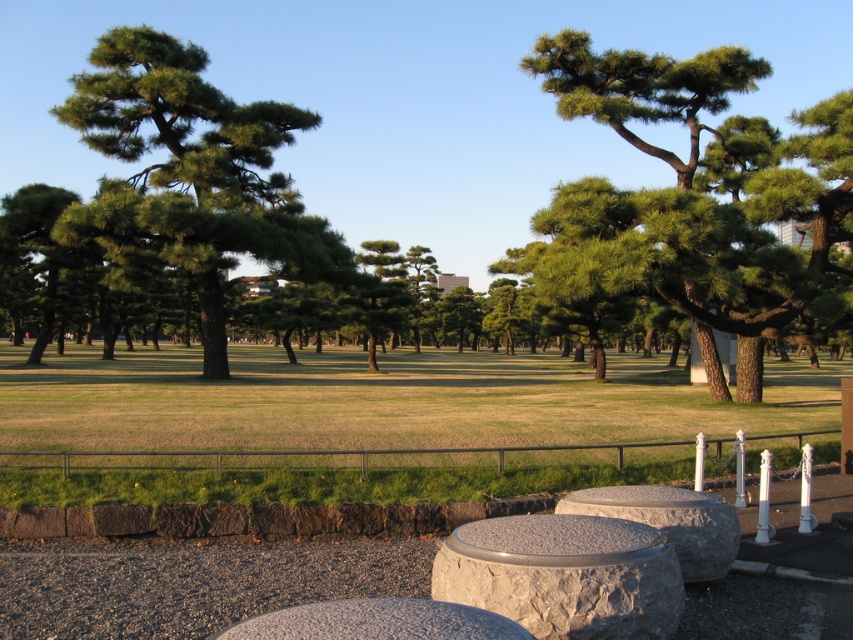
Question: Which of the following is the closest to the observer?

Choices:
 (A) green matte tree at center
 (B) green matte tree at upper left
 (C) green textured tree at center

Answer: (C)

Question: Which of the following is the farthest from the observer?

Choices:
 (A) (49, 304)
 (B) (418, 484)

Answer: (A)

Question: Does green grass at lower center have a smaller size compared to green matte tree at upper left?

Choices:
 (A) no
 (B) yes

Answer: (A)

Question: Does green textured tree at center have a greater width compared to green matte tree at center?

Choices:
 (A) yes
 (B) no

Answer: (B)

Question: Where is green grass at lower center located in relation to green matte tree at upper left in the image?

Choices:
 (A) left
 (B) right

Answer: (B)

Question: Among these points, which one is nearest to the camera?

Choices:
 (A) (537, 371)
 (B) (201, 193)
 (C) (44, 202)

Answer: (C)